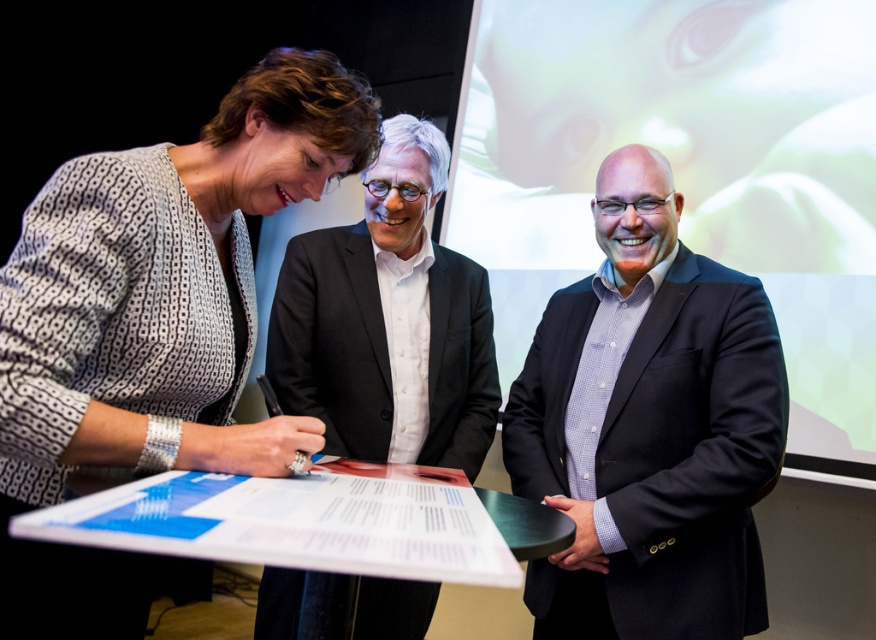
Question: Does black suit at center appear on the right side of matte black suit at center?

Choices:
 (A) yes
 (B) no

Answer: (A)

Question: Which of the following is the farthest from the observer?

Choices:
 (A) matte black suit at center
 (B) black suit at center

Answer: (A)

Question: Estimate the real-world distances between objects in this image. Which object is closer to the patterned fabric dress at left?

Choices:
 (A) black suit at center
 (B) matte black suit at center

Answer: (B)

Question: Does black suit at center appear under matte black suit at center?

Choices:
 (A) yes
 (B) no

Answer: (A)

Question: Is patterned fabric dress at left above black suit at center?

Choices:
 (A) yes
 (B) no

Answer: (A)

Question: Which point appears farthest from the camera in this image?

Choices:
 (A) (428, 152)
 (B) (653, 342)
 (C) (103, 404)

Answer: (A)